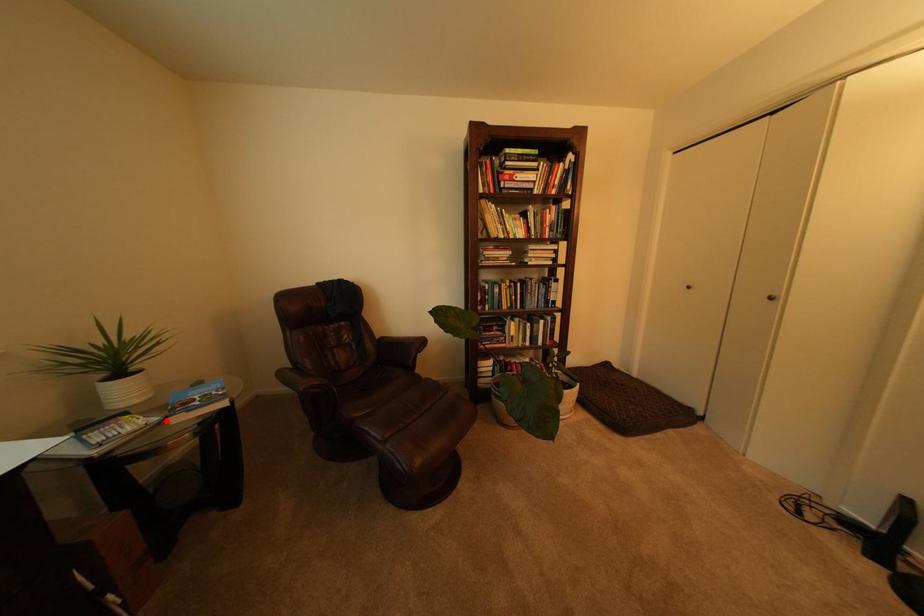
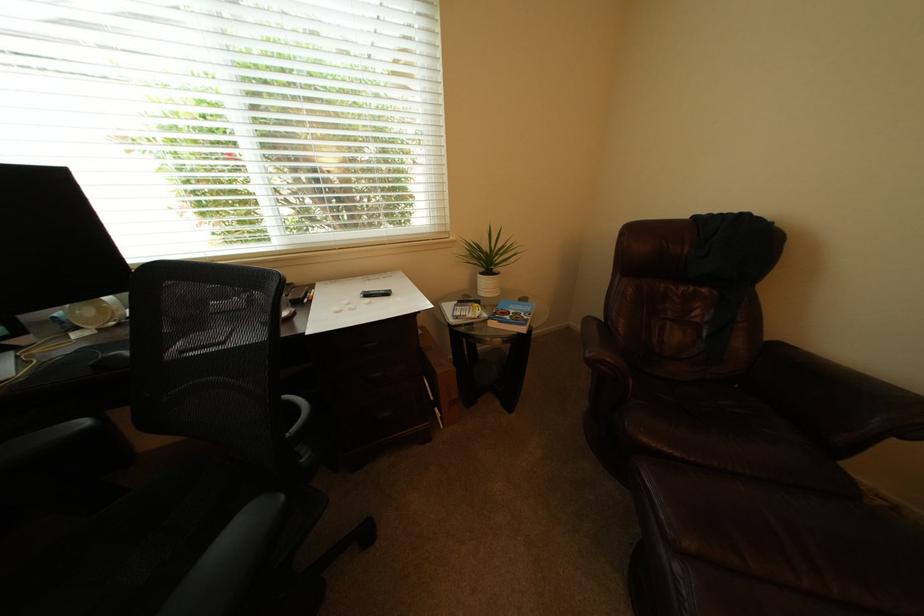
The point at the highlighted location is marked in the first image. Where is the corresponding point in the second image?

(495, 317)